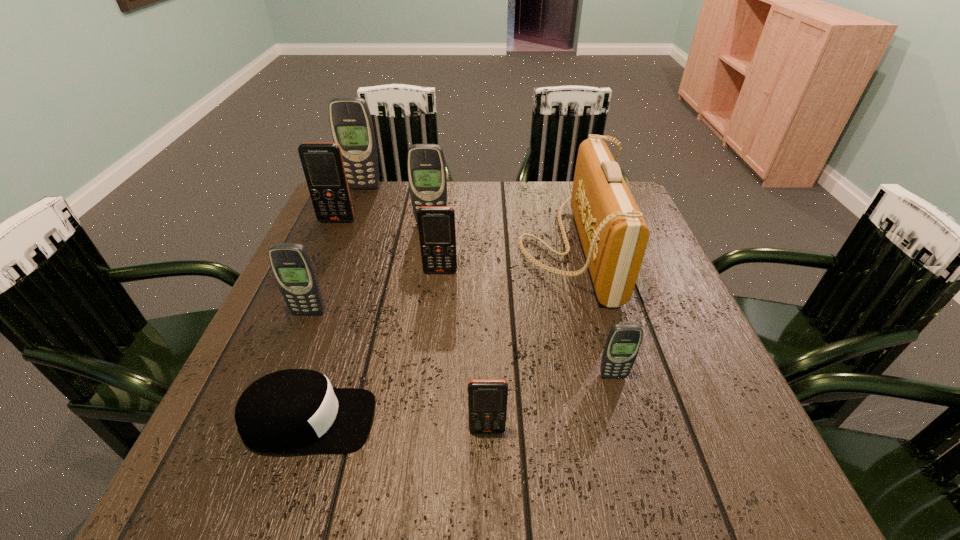
At what (x,y) coordinates should I click in order to perform the action: click on vacant area located on the decorative side of the handbag. Please return your answer as a coordinate pair (x, y). The image size is (960, 540). Looking at the image, I should click on (412, 248).

Where is `free space located on the screen of the biggest orange cellular telephone`? Image resolution: width=960 pixels, height=540 pixels. free space located on the screen of the biggest orange cellular telephone is located at coordinates (319, 263).

Identify the location of blank space located on the screen of the second gray cellular telephone from right to left. This screenshot has height=540, width=960. (418, 316).

You are a GUI agent. You are given a task and a screenshot of the screen. Output one action in this format:
    pyautogui.click(x=<x>, y=<y>)
    Task: Click on the free space located 0.070m on the screen of the third nearest cellular telephone
    The image size is (960, 540).
    Given the screenshot: What is the action you would take?
    298,341

I want to click on vacant space located on the screen of the second orange cellular telephone from left to right, so click(425, 420).

Identify the location of free location located 0.100m on the screen of the smallest orange cellular telephone. This screenshot has width=960, height=540. (489, 497).

The image size is (960, 540). I want to click on blank area located on the screen of the rightmost cellular telephone, so click(620, 402).

At what (x,y) coordinates should I click in order to perform the action: click on free space located on the front-facing side of the cap. Please return your answer as a coordinate pair (x, y). The image size is (960, 540). Looking at the image, I should click on (526, 421).

I want to click on handbag located at the far edge, so click(614, 235).

You are a GUI agent. You are given a task and a screenshot of the screen. Output one action in this format:
    pyautogui.click(x=<x>, y=<y>)
    Task: Click on the object that is at the near edge
    
    Given the screenshot: What is the action you would take?
    pyautogui.click(x=289, y=411)